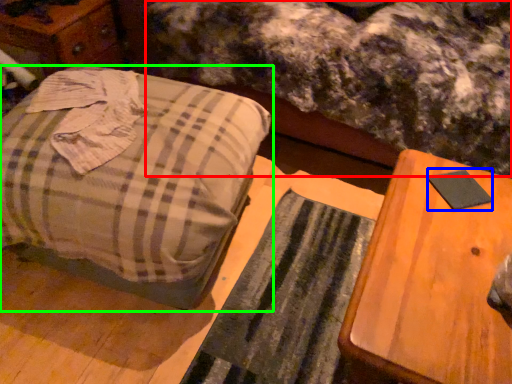
Question: Considering the real-world distances, which object is farthest from mattress (highlighted by a red box)? pad (highlighted by a blue box) or furniture (highlighted by a green box)?

Choices:
 (A) pad
 (B) furniture

Answer: (A)